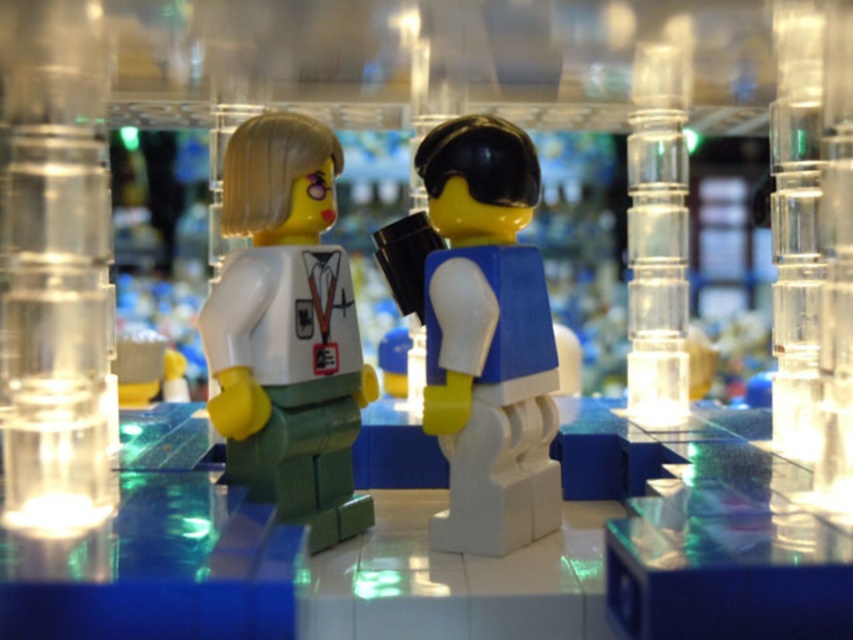
Question: Estimate the real-world distances between objects in this image. Which object is farther from the white matte/soft plastic figurine at center?

Choices:
 (A) blue matte backpack at center
 (B) transparent plastic pillar at right

Answer: (B)

Question: Estimate the real-world distances between objects in this image. Which object is farther from the white matte/soft plastic figurine at center?

Choices:
 (A) transparent plastic pillar at right
 (B) blue matte backpack at center

Answer: (A)

Question: Does blue matte backpack at center have a larger size compared to white matte/soft plastic figurine at center?

Choices:
 (A) yes
 (B) no

Answer: (A)

Question: Does blue matte backpack at center have a smaller size compared to white matte/soft plastic figurine at center?

Choices:
 (A) yes
 (B) no

Answer: (B)

Question: Among these objects, which one is nearest to the camera?

Choices:
 (A) blue matte backpack at center
 (B) transparent plastic pillar at right

Answer: (A)

Question: Does blue matte backpack at center appear over transparent plastic pillar at right?

Choices:
 (A) no
 (B) yes

Answer: (A)